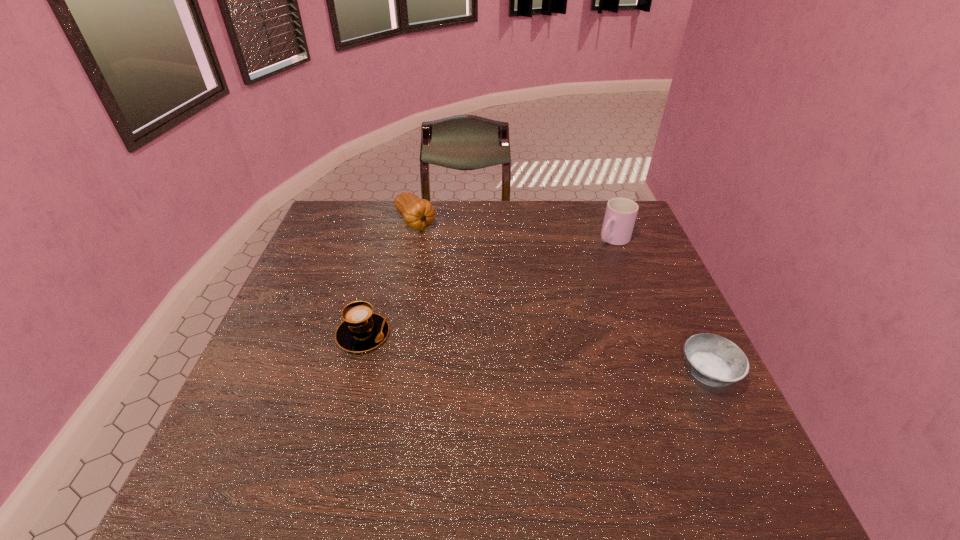
Where is `free space located on the stem side of the gourd`? This screenshot has height=540, width=960. free space located on the stem side of the gourd is located at coordinates (484, 304).

Find the location of `free point located 0.330m on the stem side of the gourd`. free point located 0.330m on the stem side of the gourd is located at coordinates click(478, 297).

Locate an element on the screen. Image resolution: width=960 pixels, height=540 pixels. cup located in the far edge section of the desktop is located at coordinates (620, 215).

This screenshot has width=960, height=540. Identify the location of gourd at the far edge. (418, 214).

This screenshot has width=960, height=540. Find the location of `ashtray present at the right edge`. ashtray present at the right edge is located at coordinates (716, 361).

Locate an element on the screen. Image resolution: width=960 pixels, height=540 pixels. cup that is at the right edge is located at coordinates (620, 215).

This screenshot has height=540, width=960. I want to click on object that is at the far right corner, so click(620, 215).

The image size is (960, 540). Find the location of `free space at the far edge of the desktop`. free space at the far edge of the desktop is located at coordinates (402, 215).

In the image, there is a desktop. Where is `vacant space at the near edge`? This screenshot has height=540, width=960. vacant space at the near edge is located at coordinates (620, 424).

Identify the location of vacant space at the left edge of the desktop. (292, 389).